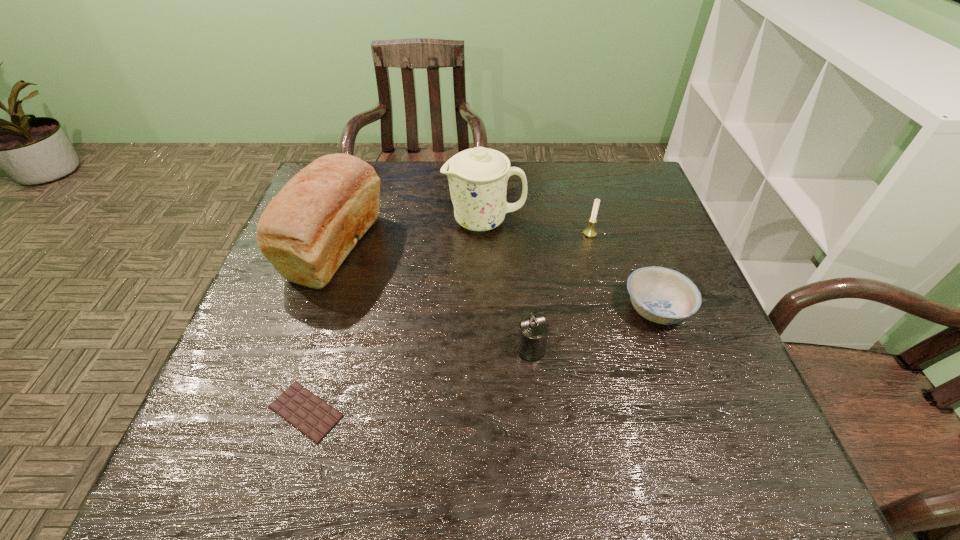
Locate an element on the screen. The image size is (960, 540). vacant region between the chinaware and the can is located at coordinates (508, 285).

Point out which object is positioned as the fourth nearest to the chinaware. Please provide its 2D coordinates. Your answer should be formatted as a tuple, i.e. [(x, y)], where the tuple contains the x and y coordinates of a point satisfying the conditions above.

[(533, 328)]

Select which object appears as the fourth closest to the fifth tallest object. Please provide its 2D coordinates. Your answer should be formatted as a tuple, i.e. [(x, y)], where the tuple contains the x and y coordinates of a point satisfying the conditions above.

[(308, 229)]

Where is `vacant space that satisfies the following two spatial constraints: 1. on the front side of the bread; 2. on the right side of the bowl`? This screenshot has height=540, width=960. vacant space that satisfies the following two spatial constraints: 1. on the front side of the bread; 2. on the right side of the bowl is located at coordinates (315, 309).

You are a GUI agent. You are given a task and a screenshot of the screen. Output one action in this format:
    pyautogui.click(x=<x>, y=<y>)
    Task: Click on the free space that satisfies the following two spatial constraints: 1. on the back side of the rightmost object; 2. on the spout of the chinaware
    The image size is (960, 540).
    Given the screenshot: What is the action you would take?
    pyautogui.click(x=624, y=221)